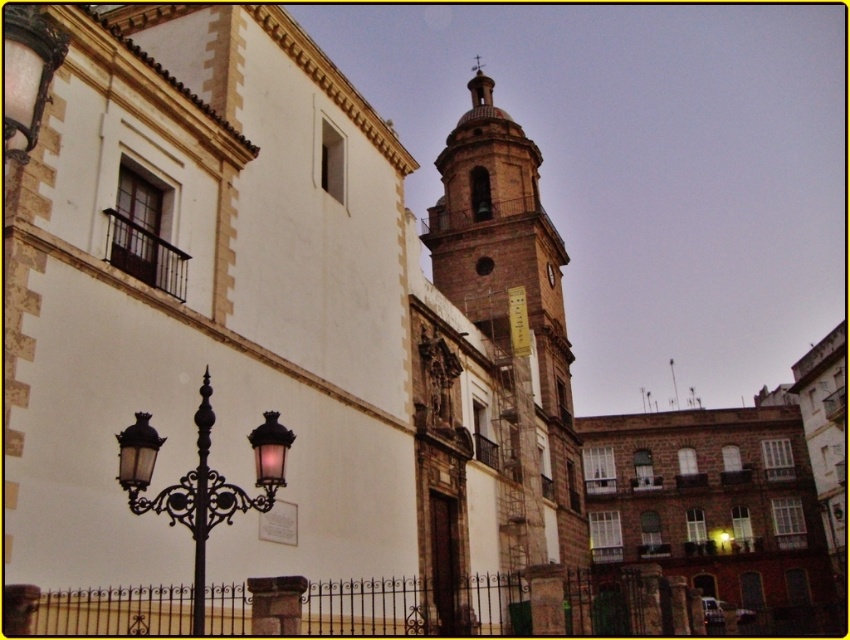
Question: Which point is farther from the camera taking this photo?

Choices:
 (A) (133, 426)
 (B) (452, 499)

Answer: (B)

Question: Is brown stone church at center behind brown stone clock tower at center?

Choices:
 (A) yes
 (B) no

Answer: (B)

Question: Which point is closer to the camera taking this photo?

Choices:
 (A) (541, 564)
 (B) (384, 259)
 (C) (253, 506)

Answer: (C)

Question: Considering the real-world distances, which object is farthest from the brown stone church at center?

Choices:
 (A) matte black lamp post at lower left
 (B) brown stone clock tower at center

Answer: (A)

Question: Is brown stone clock tower at center smaller than matte black lamp post at lower left?

Choices:
 (A) no
 (B) yes

Answer: (A)

Question: Is brown stone clock tower at center positioned before matte black lamp post at lower left?

Choices:
 (A) yes
 (B) no

Answer: (B)